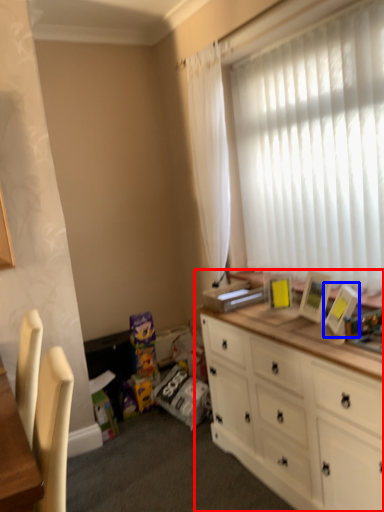
Question: Which point is further to the camera, cabinetry (highlighted by a red box) or picture frame (highlighted by a blue box)?

Choices:
 (A) cabinetry
 (B) picture frame

Answer: (B)